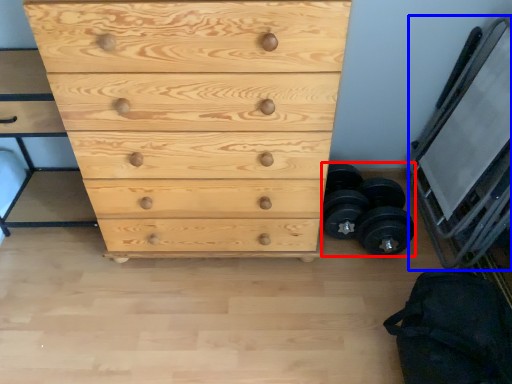
Question: Which of the following is the closest to the observer, dumbbell (highlighted by a red box) or bunk bed (highlighted by a blue box)?

Choices:
 (A) dumbbell
 (B) bunk bed

Answer: (B)